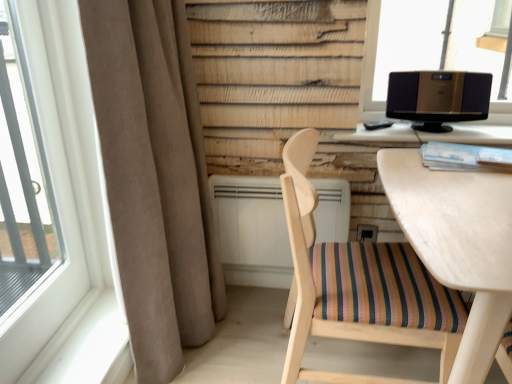
Question: Should I look upward or downward to see transparent glass window at upper right, acting as the first window starting from the right?

Choices:
 (A) up
 (B) down

Answer: (A)

Question: From a real-world perspective, is transparent glass window at upper right, acting as the first window starting from the right, positioned over white plastic window at left, which ranks as the second window in right-to-left order, based on gravity?

Choices:
 (A) yes
 (B) no

Answer: (A)

Question: Is transparent glass window at upper right, marked as the second window in a left-to-right arrangement, touching white plastic window at left, marked as the first window in a left-to-right arrangement?

Choices:
 (A) no
 (B) yes

Answer: (A)

Question: Is transparent glass window at upper right, marked as the 2th window in a front-to-back arrangement, to the right of white plastic window at left, which ranks as the second window in right-to-left order, from the viewer's perspective?

Choices:
 (A) no
 (B) yes

Answer: (B)

Question: From the image's perspective, is transparent glass window at upper right, acting as the first window starting from the right, below white plastic window at left, marked as the first window in a left-to-right arrangement?

Choices:
 (A) no
 (B) yes

Answer: (A)

Question: Is transparent glass window at upper right, which is the 1th window from back to front, taller than white plastic window at left, marked as the first window in a left-to-right arrangement?

Choices:
 (A) yes
 (B) no

Answer: (B)

Question: Does transparent glass window at upper right, marked as the 2th window in a front-to-back arrangement, come in front of white plastic window at left, marked as the first window in a left-to-right arrangement?

Choices:
 (A) yes
 (B) no

Answer: (B)

Question: Would you say white plastic window at left, which ranks as the first window in front-to-back order, contains wooden table at right?

Choices:
 (A) no
 (B) yes

Answer: (A)

Question: Can you confirm if white plastic window at left, acting as the 2th window starting from the back, is thinner than wooden table at right?

Choices:
 (A) no
 (B) yes

Answer: (B)

Question: Can you confirm if white plastic window at left, which ranks as the first window in front-to-back order, is smaller than wooden table at right?

Choices:
 (A) no
 (B) yes

Answer: (B)

Question: Is white plastic window at left, marked as the first window in a left-to-right arrangement, taller than wooden table at right?

Choices:
 (A) no
 (B) yes

Answer: (B)

Question: Considering the relative positions of white plastic window at left, which ranks as the first window in front-to-back order, and wooden table at right in the image provided, is white plastic window at left, which ranks as the first window in front-to-back order, to the right of wooden table at right from the viewer's perspective?

Choices:
 (A) yes
 (B) no

Answer: (B)

Question: Considering the relative positions of white plastic window at left, which ranks as the second window in right-to-left order, and wooden table at right in the image provided, is white plastic window at left, which ranks as the second window in right-to-left order, to the left of wooden table at right from the viewer's perspective?

Choices:
 (A) no
 (B) yes

Answer: (B)

Question: From the image's perspective, is beige fabric curtain at left under metallic silver speaker at upper right?

Choices:
 (A) yes
 (B) no

Answer: (A)